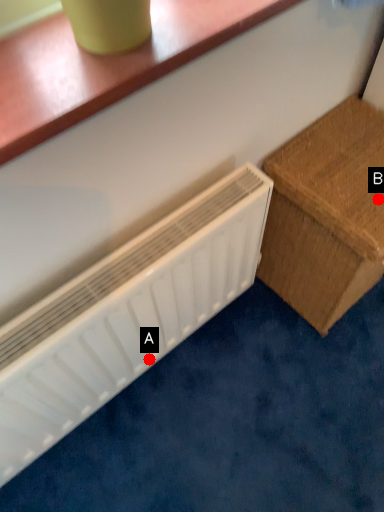
Question: Two points are circled on the image, labeled by A and B beside each circle. Which point is closer to the camera taking this photo?

Choices:
 (A) A is closer
 (B) B is closer

Answer: (B)